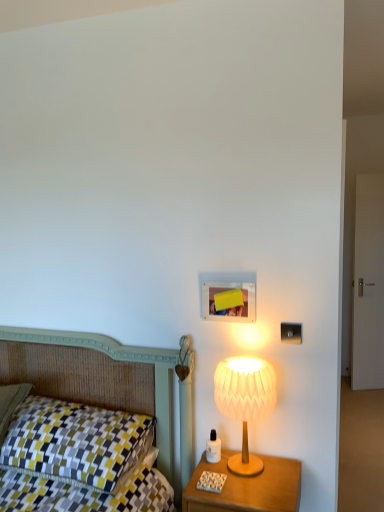
Question: Is checkered fabric pillow at left at the back of wooden nightstand at right?

Choices:
 (A) yes
 (B) no

Answer: (B)

Question: Are wooden nightstand at right and checkered fabric pillow at left far apart?

Choices:
 (A) no
 (B) yes

Answer: (A)

Question: Considering the relative sizes of wooden nightstand at right and checkered fabric pillow at left in the image provided, is wooden nightstand at right shorter than checkered fabric pillow at left?

Choices:
 (A) yes
 (B) no

Answer: (B)

Question: Considering the relative positions of wooden nightstand at right and checkered fabric pillow at left in the image provided, is wooden nightstand at right to the left of checkered fabric pillow at left from the viewer's perspective?

Choices:
 (A) yes
 (B) no

Answer: (B)

Question: Can you confirm if wooden nightstand at right is wider than checkered fabric pillow at left?

Choices:
 (A) no
 (B) yes

Answer: (A)

Question: Relative to white paper lampshade at right, is wooden nightstand at right in front or behind?

Choices:
 (A) behind
 (B) front

Answer: (B)

Question: In terms of height, does wooden nightstand at right look taller or shorter compared to white paper lampshade at right?

Choices:
 (A) tall
 (B) short

Answer: (B)

Question: Is wooden nightstand at right bigger or smaller than white paper lampshade at right?

Choices:
 (A) big
 (B) small

Answer: (A)

Question: Looking at their shapes, would you say wooden nightstand at right is wider or thinner than white paper lampshade at right?

Choices:
 (A) wide
 (B) thin

Answer: (A)

Question: Is wooden nightstand at right in front of or behind checkered fabric pillow at left in the image?

Choices:
 (A) behind
 (B) front

Answer: (B)

Question: Do you think wooden nightstand at right is within checkered fabric pillow at left, or outside of it?

Choices:
 (A) inside
 (B) outside

Answer: (B)

Question: Is wooden nightstand at right bigger or smaller than checkered fabric pillow at left?

Choices:
 (A) big
 (B) small

Answer: (B)

Question: From the image's perspective, is wooden nightstand at right positioned above or below checkered fabric pillow at left?

Choices:
 (A) above
 (B) below

Answer: (B)

Question: Considering the positions of checkered fabric pillow at left and wooden nightstand at right in the image, is checkered fabric pillow at left bigger or smaller than wooden nightstand at right?

Choices:
 (A) small
 (B) big

Answer: (B)

Question: From a real-world perspective, is checkered fabric pillow at left above or below wooden nightstand at right?

Choices:
 (A) above
 (B) below

Answer: (A)